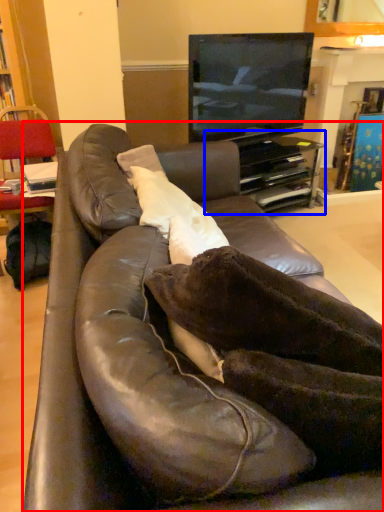
Question: Which object appears farthest to the camera in this image, studio couch (highlighted by a red box) or entertainment center (highlighted by a blue box)?

Choices:
 (A) studio couch
 (B) entertainment center

Answer: (B)